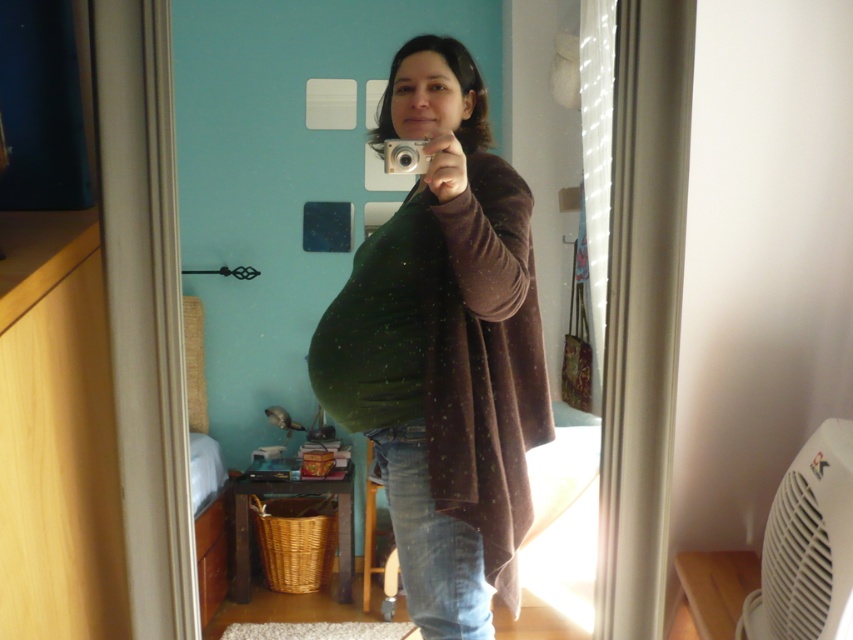
Between green fabric pillow at center and green fuzzy blanket at center, which one is positioned higher?

Positioned higher is green fabric pillow at center.

Is point (281, 173) farther from viewer compared to point (387, 413)?

Yes, point (281, 173) is behind point (387, 413).

Which is behind, point (549, 362) or point (397, 550)?

Positioned behind is point (549, 362).

At what (x,y) coordinates should I click in order to perform the action: click on green fabric pillow at center. Please return your answer as a coordinate pair (x, y). The width and height of the screenshot is (853, 640). Looking at the image, I should click on (332, 170).